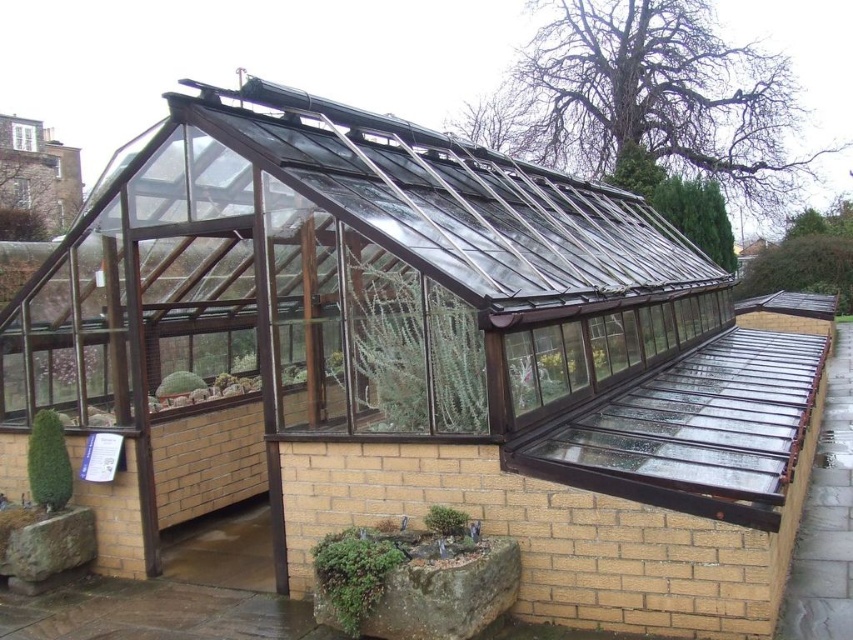
Question: Which object is positioned closest to the green matte cactus at center?

Choices:
 (A) green matte coniferous tree at lower left
 (B) green mossy rock at lower center
 (C) green leafy plant at center

Answer: (A)

Question: Is the position of green matte coniferous tree at lower left more distant than that of green matte plant at center?

Choices:
 (A) no
 (B) yes

Answer: (A)

Question: Can you confirm if green matte glass plant at center is smaller than green matte coniferous tree at lower left?

Choices:
 (A) yes
 (B) no

Answer: (B)

Question: Which of the following is the farthest from the observer?

Choices:
 (A) green matte plant at center
 (B) green matte cactus at center

Answer: (B)

Question: Which object appears farthest from the camera in this image?

Choices:
 (A) green matte plant at center
 (B) green matte glass plant at center
 (C) green mossy rock at lower center
 (D) green matte coniferous tree at lower left

Answer: (A)

Question: Is green matte glass plant at center smaller than green matte plant at center?

Choices:
 (A) yes
 (B) no

Answer: (B)